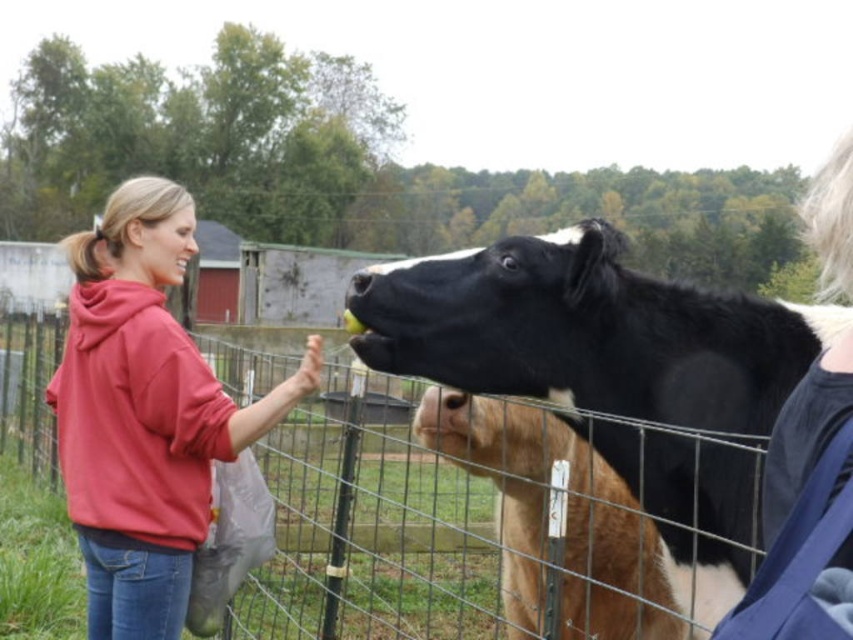
Question: Which is farther from the brown furry calf at center?

Choices:
 (A) matte red hoodie at center left
 (B) black glossy cow at upper center

Answer: (A)

Question: Is black glossy cow at upper center wider than brown furry calf at center?

Choices:
 (A) no
 (B) yes

Answer: (B)

Question: Which object is positioned closest to the matte red hoodie at center left?

Choices:
 (A) black glossy cow at upper center
 (B) brown furry calf at center

Answer: (A)

Question: Which object is the farthest from the black glossy cow at upper center?

Choices:
 (A) brown furry calf at center
 (B) matte red hoodie at center left

Answer: (B)

Question: In this image, where is matte red hoodie at center left located relative to brown furry calf at center?

Choices:
 (A) below
 (B) above

Answer: (B)

Question: Can you confirm if matte red hoodie at center left is thinner than brown furry calf at center?

Choices:
 (A) yes
 (B) no

Answer: (B)